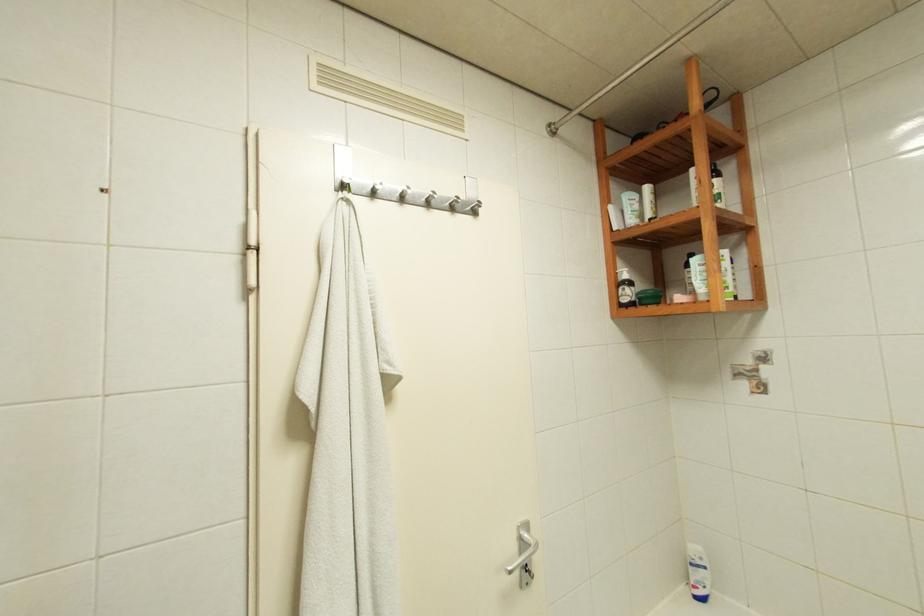
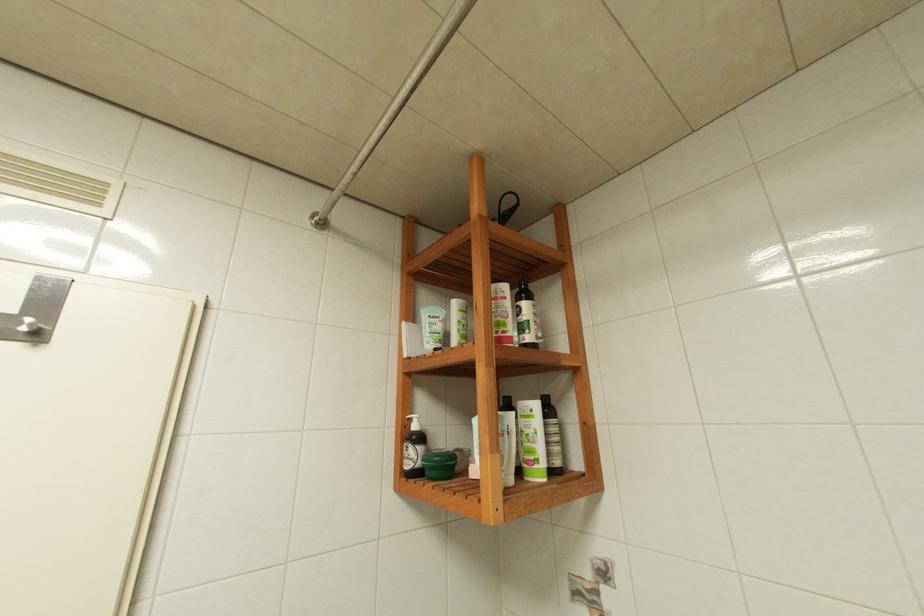
Question: How did the camera likely rotate?

Choices:
 (A) Left
 (B) Right
 (C) Up
 (D) Down

Answer: (C)